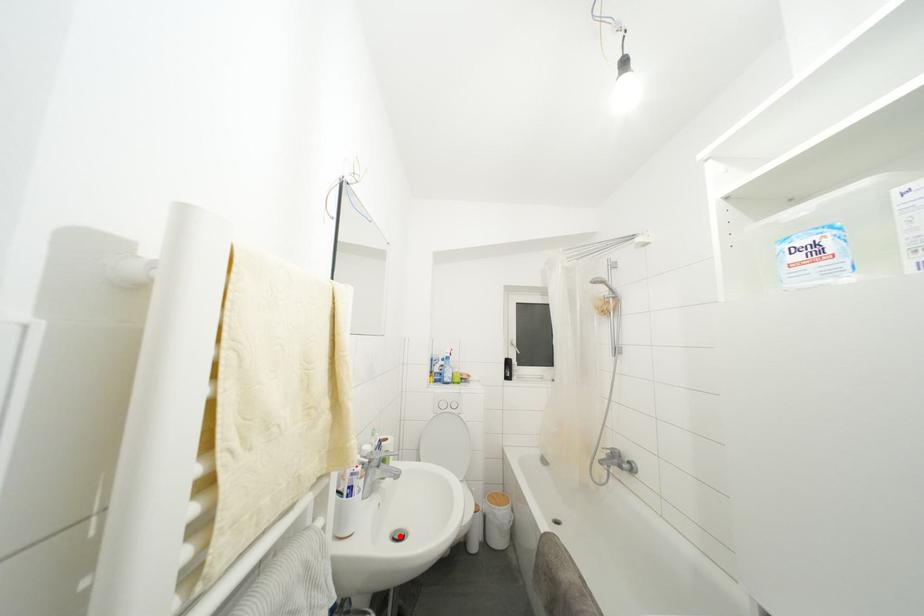
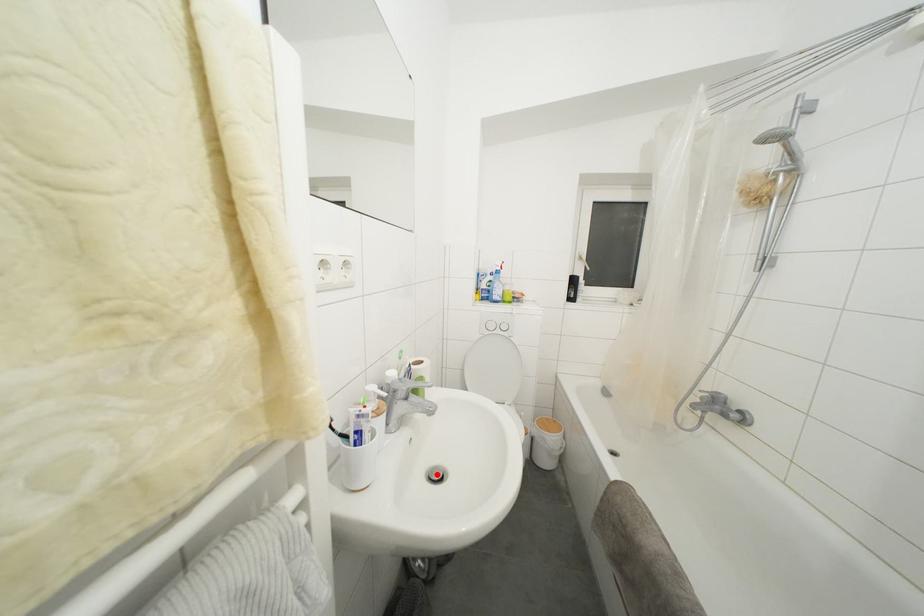
I am providing you with two images of the same scene from different viewpoints. A red point is marked on the first image and another point is marked on the second image. Do the highlighted points in image1 and image2 indicate the same real-world spot?

Yes